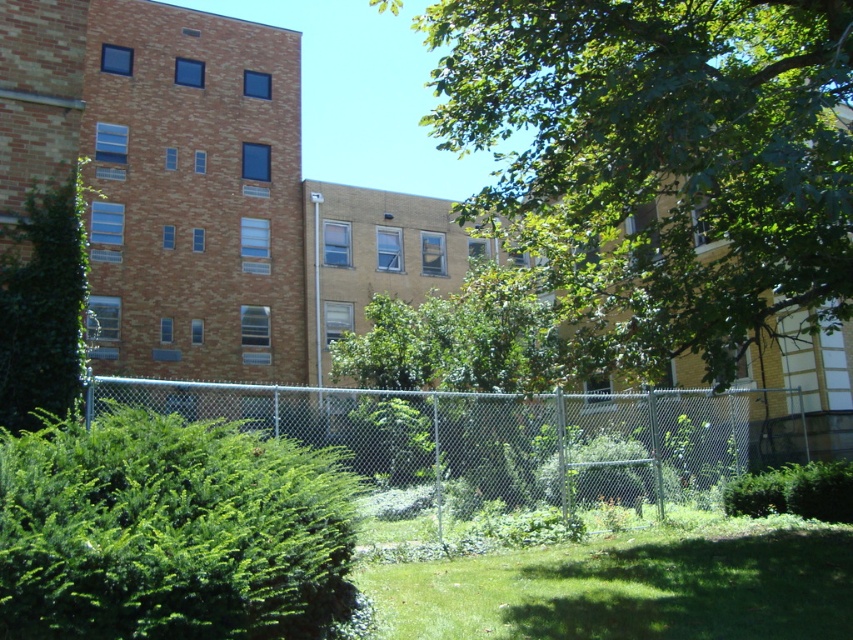
Which is below, green leafy bush at lower left or green grass at lower center?

green grass at lower center is lower down.

Is green leafy bush at lower left thinner than green grass at lower center?

No.

Identify the location of green leafy bush at lower left. Image resolution: width=853 pixels, height=640 pixels. (173, 531).

Is green leafy tree at upper center wider than green grass at lower center?

Correct, the width of green leafy tree at upper center exceeds that of green grass at lower center.

Can you confirm if green leafy tree at upper center is positioned above green grass at lower center?

Indeed, green leafy tree at upper center is positioned over green grass at lower center.

Is point (531, 144) behind point (480, 556)?

Yes.

What are the coordinates of `green leafy tree at upper center` in the screenshot? It's located at (662, 160).

Which is behind, point (764, 0) or point (65, 237)?

Positioned behind is point (65, 237).

Who is positioned more to the right, green leafy tree at upper center or green leafy bush at left?

Positioned to the right is green leafy tree at upper center.

Between point (450, 74) and point (50, 380), which one is positioned in front?

Positioned in front is point (50, 380).

Locate an element on the screen. green leafy tree at upper center is located at coordinates (662, 160).